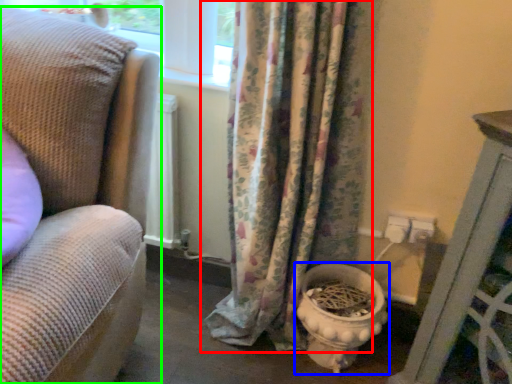
Question: Considering the real-world distances, which object is closest to curtain (highlighted by a red box)? toilet bowl (highlighted by a blue box) or studio couch (highlighted by a green box).

Choices:
 (A) toilet bowl
 (B) studio couch

Answer: (A)